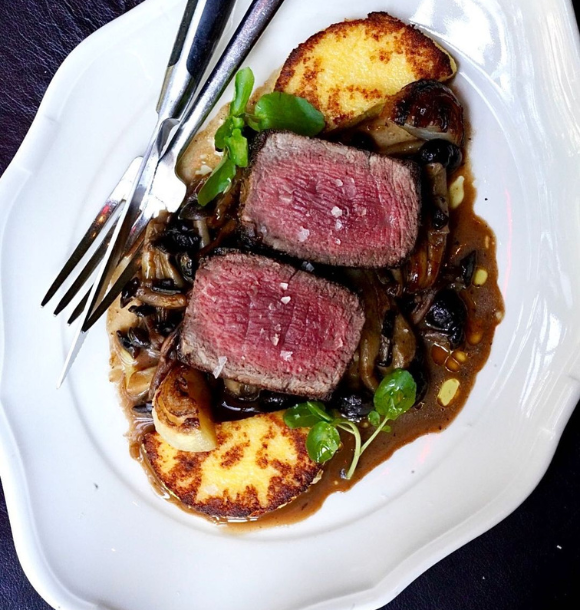
Where is `place to hold utensil`? This screenshot has width=580, height=610. place to hold utensil is located at coordinates (195, 21), (261, 15).